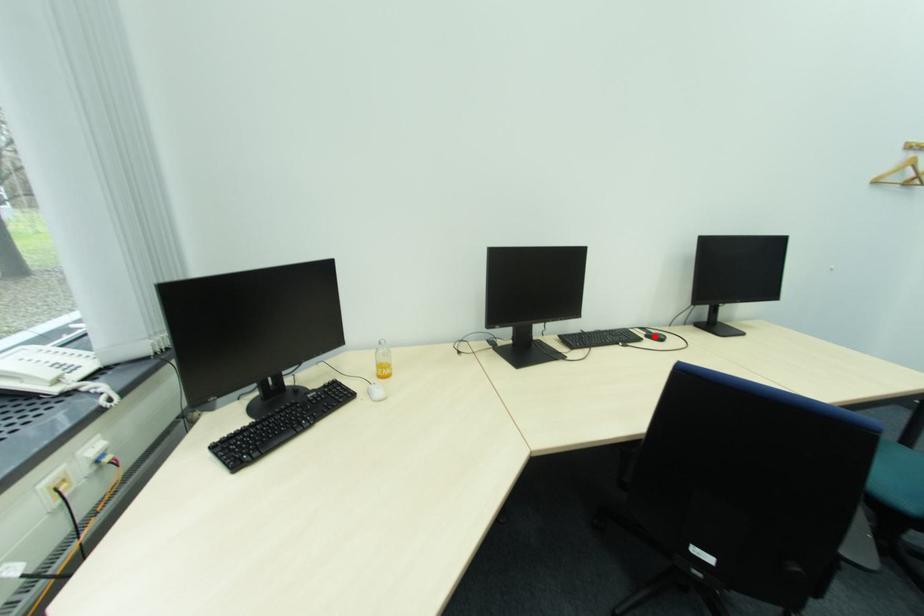
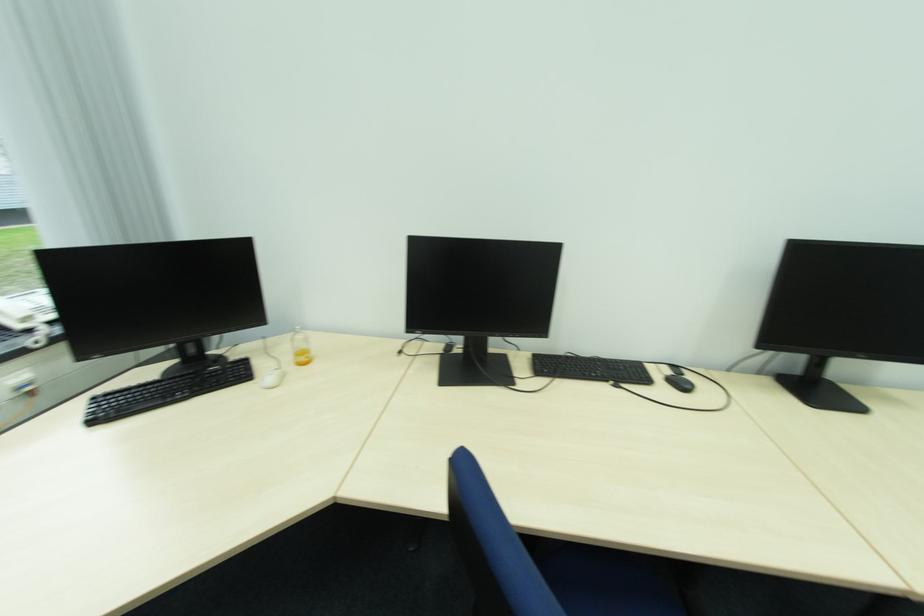
Where in the second image is the point corresponding to the highlighted location from the first image?

(677, 379)